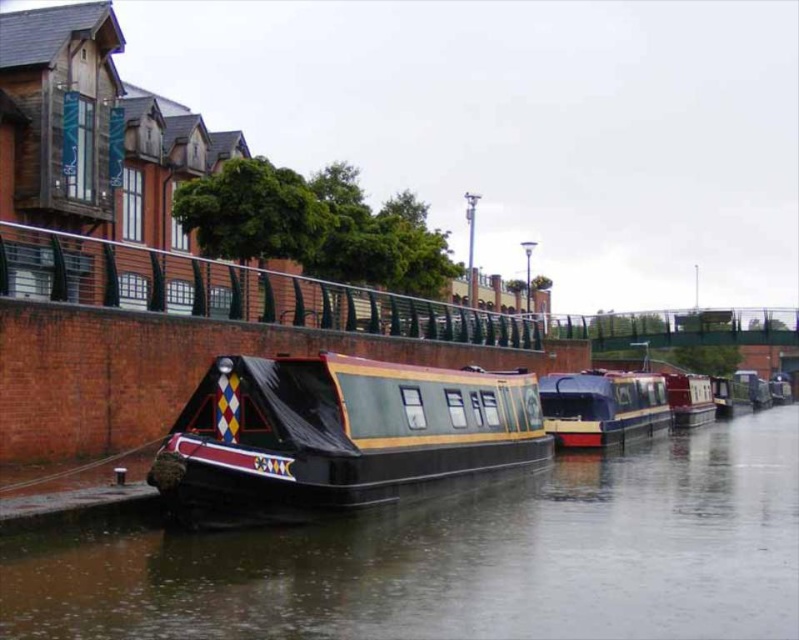
Is black rubber boat at center to the left of polished wood boat at center from the viewer's perspective?

In fact, black rubber boat at center is to the right of polished wood boat at center.

Measure the distance between black rubber boat at center and polished wood boat at center.

black rubber boat at center is 13.26 feet away from polished wood boat at center.

At what (x,y) coordinates should I click in order to perform the action: click on black rubber boat at center. Please return your answer as a coordinate pair (x, y). This screenshot has width=799, height=640. Looking at the image, I should click on (463, 557).

Find the location of a particular element. This screenshot has height=640, width=799. black rubber boat at center is located at coordinates (463, 557).

Is the position of black rubber boat at center more distant than that of shiny blue and yellow boat at center?

No, black rubber boat at center is closer to the viewer.

Which is more to the left, black rubber boat at center or shiny blue and yellow boat at center?

black rubber boat at center is more to the left.

I want to click on black rubber boat at center, so click(x=463, y=557).

Where is `black rubber boat at center`? The width and height of the screenshot is (799, 640). black rubber boat at center is located at coordinates [x=463, y=557].

Is shiny blue and yellow boat at center wider than red glossy canal boat at center?

Yes.

Who is taller, shiny blue and yellow boat at center or red glossy canal boat at center?

red glossy canal boat at center

Image resolution: width=799 pixels, height=640 pixels. I want to click on shiny blue and yellow boat at center, so click(602, 406).